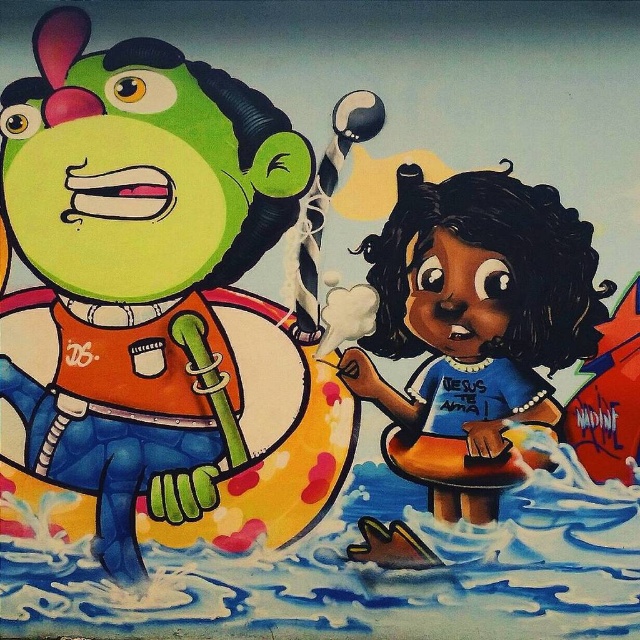
Is green rubber alien at left to the right of smooth blue life preserver at center from the viewer's perspective?

No, green rubber alien at left is not to the right of smooth blue life preserver at center.

Which is in front, point (173, 476) or point (397, 449)?

Positioned in front is point (397, 449).

Does point (26, 148) come closer to viewer compared to point (602, 307)?

That is False.

Identify the location of green rubber alien at left. The height and width of the screenshot is (640, 640). (141, 276).